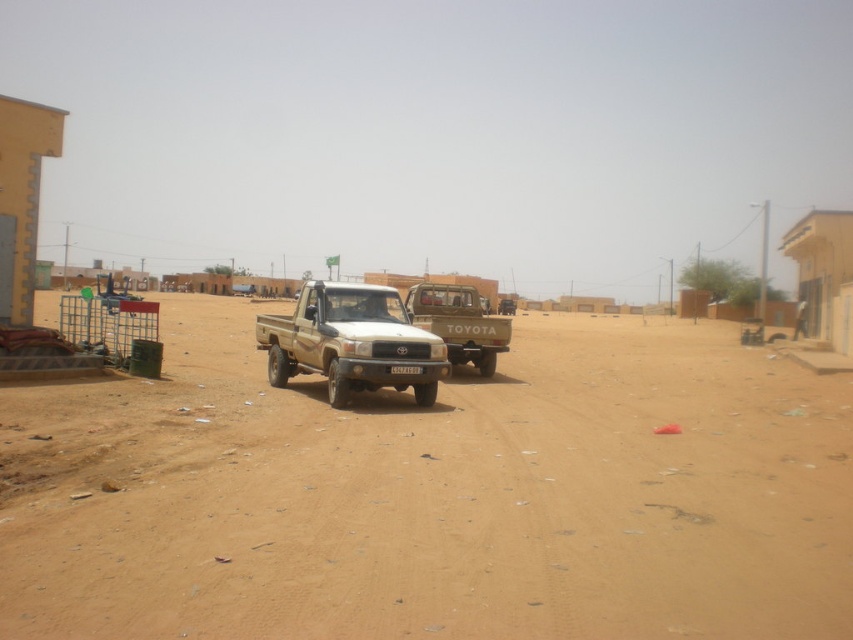
You are a delivery driver who needs to park your truck in the exact spot where the matte brown truck at center is currently parked. According to the coordinates provided, where should you position your truck?

You should position your truck at the coordinates point (x=460, y=323) where the matte brown truck at center is located.

You are a photographer trying to capture the entire scene of the brown sandy dirt at center and the black plastic license plate at center in one shot. Based on their sizes, which object will appear more dominant in the photo?

The brown sandy dirt at center has a larger size compared to the black plastic license plate at center, so it will appear more dominant in the photo.

You are standing in the middle of the dusty open area and want to move towards the two points marked in the image. Which point, point (726,506) or point (397,385), is closer to you?

Point (726,506) is closer to you than point (397,385).